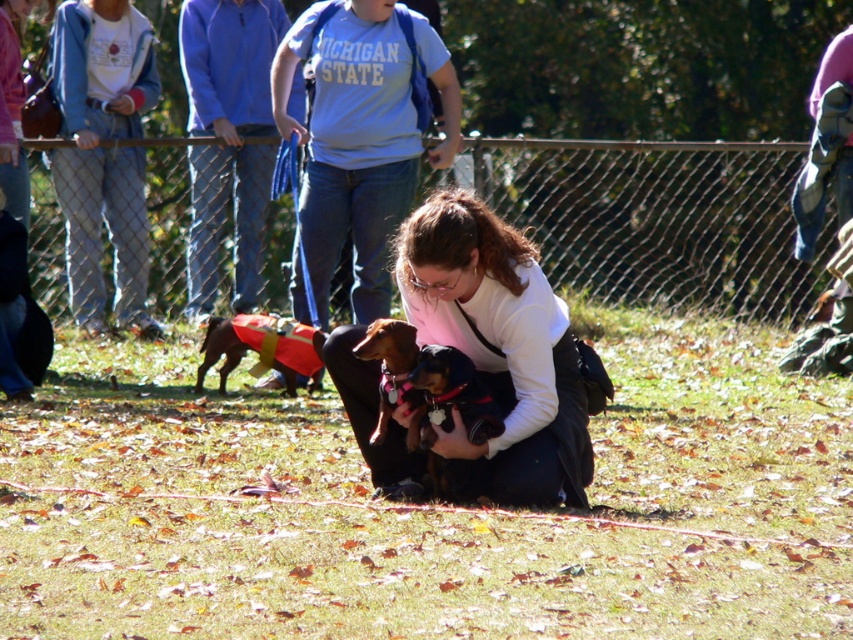
Between white matte shirt at center and brown leather dog at center, which one has more height?

Standing taller between the two is white matte shirt at center.

Who is higher up, white matte shirt at center or brown leather dog at center?

brown leather dog at center is above.

Describe the element at coordinates (498, 349) in the screenshot. I see `white matte shirt at center` at that location.

At what (x,y) coordinates should I click in order to perform the action: click on white matte shirt at center. Please return your answer as a coordinate pair (x, y). Looking at the image, I should click on (498, 349).

Does white matte shirt at center have a larger size compared to brown fur dog at center?

Yes.

Who is more forward, (422, 280) or (361, 353)?

Point (422, 280)

The height and width of the screenshot is (640, 853). I want to click on white matte shirt at center, so click(498, 349).

Is white matte shirt at center thinner than velvety black dog at center?

No, white matte shirt at center is not thinner than velvety black dog at center.

Who is lower down, white matte shirt at center or velvety black dog at center?

velvety black dog at center is below.

Is point (544, 432) positioned before point (460, 403)?

No, it is behind (460, 403).

Where is `white matte shirt at center`? The height and width of the screenshot is (640, 853). white matte shirt at center is located at coordinates (498, 349).